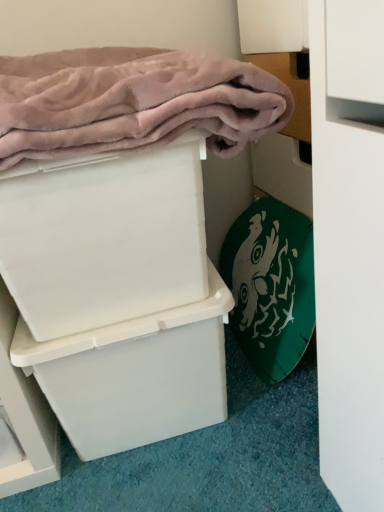
In order to face pink plush bath towel at upper left, which is the first bath towel in left-to-right order, should I rotate leftwards or rightwards?

A 11.622 degree turn to the left will do.

Describe the element at coordinates (104, 236) in the screenshot. This screenshot has height=512, width=384. I see `white plastic box at upper left, which is counted as the 2th box, starting from the bottom` at that location.

Locate an element on the screen. pink plush bath towel at upper left, the 2th bath towel from the right is located at coordinates (132, 101).

Is white plastic box at center, the first box in the bottom-to-top sequence, looking in the opposite direction of green fabric bath towel at lower right, which appears as the second bath towel when viewed from the left?

white plastic box at center, the first box in the bottom-to-top sequence, does not have its back to green fabric bath towel at lower right, which appears as the second bath towel when viewed from the left.

Considering the sizes of objects white plastic box at center, the first box in the bottom-to-top sequence, and green fabric bath towel at lower right, which is the first bath towel from bottom to top, in the image provided, who is taller, white plastic box at center, the first box in the bottom-to-top sequence, or green fabric bath towel at lower right, which is the first bath towel from bottom to top,?

With more height is green fabric bath towel at lower right, which is the first bath towel from bottom to top.

From the image's perspective, which bath towel is the 1st one above the white plastic box at center, the first box in the bottom-to-top sequence? Please provide its 2D coordinates.

[(271, 285)]

Can you confirm if white plastic box at center, the first box in the bottom-to-top sequence, is wider than green fabric bath towel at lower right, positioned as the second bath towel in top-to-bottom order?

Correct, the width of white plastic box at center, the first box in the bottom-to-top sequence, exceeds that of green fabric bath towel at lower right, positioned as the second bath towel in top-to-bottom order.

In terms of height, does pink plush bath towel at upper left, which appears as the 2th bath towel when ordered from the bottom, look taller or shorter compared to white plastic box at upper left, which is counted as the 2th box, starting from the bottom?

Considering their sizes, pink plush bath towel at upper left, which appears as the 2th bath towel when ordered from the bottom, has less height than white plastic box at upper left, which is counted as the 2th box, starting from the bottom.

Does pink plush bath towel at upper left, which is the first bath towel in left-to-right order, have a greater width compared to white plastic box at upper left, the first box in the top-to-bottom sequence?

Indeed, pink plush bath towel at upper left, which is the first bath towel in left-to-right order, has a greater width compared to white plastic box at upper left, the first box in the top-to-bottom sequence.

Considering the positions of objects pink plush bath towel at upper left, which is the first bath towel in left-to-right order, and white plastic box at upper left, the first box in the top-to-bottom sequence, in the image provided, who is more to the left, pink plush bath towel at upper left, which is the first bath towel in left-to-right order, or white plastic box at upper left, the first box in the top-to-bottom sequence,?

From the viewer's perspective, white plastic box at upper left, the first box in the top-to-bottom sequence, appears more on the left side.

Is white plastic box at upper left, which is counted as the 2th box, starting from the bottom, not close to white plastic box at center, the second box viewed from the top?

No, there isn't a large distance between white plastic box at upper left, which is counted as the 2th box, starting from the bottom, and white plastic box at center, the second box viewed from the top.

Considering their positions, is white plastic box at upper left, the first box in the top-to-bottom sequence, located in front of or behind white plastic box at center, the second box viewed from the top?

In the image, white plastic box at upper left, the first box in the top-to-bottom sequence, appears in front of white plastic box at center, the second box viewed from the top.

Is white plastic box at upper left, which is counted as the 2th box, starting from the bottom, shorter than white plastic box at center, the second box viewed from the top?

Yes, white plastic box at upper left, which is counted as the 2th box, starting from the bottom, is shorter than white plastic box at center, the second box viewed from the top.

Is white plastic box at upper left, the first box in the top-to-bottom sequence, oriented towards white plastic box at center, the second box viewed from the top?

No, white plastic box at upper left, the first box in the top-to-bottom sequence, is not oriented towards white plastic box at center, the second box viewed from the top.

Is there a large distance between green fabric bath towel at lower right, which is the first bath towel from bottom to top, and white plastic box at center, the first box in the bottom-to-top sequence?

green fabric bath towel at lower right, which is the first bath towel from bottom to top, is actually quite close to white plastic box at center, the first box in the bottom-to-top sequence.

Based on the photo, considering the positions of objects green fabric bath towel at lower right, which appears as the second bath towel when viewed from the left, and white plastic box at center, the first box in the bottom-to-top sequence, in the image provided, who is more to the right, green fabric bath towel at lower right, which appears as the second bath towel when viewed from the left, or white plastic box at center, the first box in the bottom-to-top sequence,?

Positioned to the right is green fabric bath towel at lower right, which appears as the second bath towel when viewed from the left.

From the image's perspective, which one is positioned lower, green fabric bath towel at lower right, which appears as the second bath towel when viewed from the left, or white plastic box at center, the first box in the bottom-to-top sequence?

white plastic box at center, the first box in the bottom-to-top sequence, appears lower in the image.

Which is nearer, (274,202) or (99,395)?

The point (99,395) is closer.

Is white plastic box at upper left, the first box in the top-to-bottom sequence, completely or partially outside of green fabric bath towel at lower right, which is the first bath towel from bottom to top?

Yes, white plastic box at upper left, the first box in the top-to-bottom sequence, is not within green fabric bath towel at lower right, which is the first bath towel from bottom to top.

Are white plastic box at upper left, which is counted as the 2th box, starting from the bottom, and green fabric bath towel at lower right, which is the first bath towel from bottom to top, far apart?

No, white plastic box at upper left, which is counted as the 2th box, starting from the bottom, is in close proximity to green fabric bath towel at lower right, which is the first bath towel from bottom to top.

Who is taller, white plastic box at upper left, which is counted as the 2th box, starting from the bottom, or green fabric bath towel at lower right, which is the first bath towel from bottom to top?

With more height is green fabric bath towel at lower right, which is the first bath towel from bottom to top.

Measure the distance from white plastic box at center, the second box viewed from the top, to pink plush bath towel at upper left, the 2th bath towel from the right.

They are 14.73 inches apart.

From the image's perspective, which is below, white plastic box at center, the first box in the bottom-to-top sequence, or pink plush bath towel at upper left, which is the first bath towel in left-to-right order?

white plastic box at center, the first box in the bottom-to-top sequence, from the image's perspective.

The height and width of the screenshot is (512, 384). What are the coordinates of `the 2nd box below the pink plush bath towel at upper left, the 2th bath towel from the right (from the image's perspective)` in the screenshot? It's located at (135, 375).

From a real-world perspective, is pink plush bath towel at upper left, which appears as the 2th bath towel when ordered from the bottom, located higher than green fabric bath towel at lower right, which is counted as the first bath towel, starting from the right?

Yes.

From the image's perspective, does pink plush bath towel at upper left, which is the first bath towel in left-to-right order, appear lower than green fabric bath towel at lower right, which is counted as the first bath towel, starting from the right?

No, from the image's perspective, pink plush bath towel at upper left, which is the first bath towel in left-to-right order, is not below green fabric bath towel at lower right, which is counted as the first bath towel, starting from the right.

Is pink plush bath towel at upper left, which appears as the 2th bath towel when ordered from the bottom, thinner than green fabric bath towel at lower right, which is counted as the first bath towel, starting from the right?

No.

You are a GUI agent. You are given a task and a screenshot of the screen. Output one action in this format:
    pyautogui.click(x=<x>, y=<y>)
    Task: Click on the box that is the 1st one when counting forward from the green fabric bath towel at lower right, positioned as the second bath towel in top-to-bottom order
    Image resolution: width=384 pixels, height=512 pixels.
    Given the screenshot: What is the action you would take?
    pyautogui.click(x=135, y=375)

In the image, there is a white plastic box at upper left, the first box in the top-to-bottom sequence. At what (x,y) coordinates should I click in order to perform the action: click on bath towel above it (from the image's perspective). Please return your answer as a coordinate pair (x, y). Looking at the image, I should click on (132, 101).

Consider the image. Looking at the image, which one is located closer to white plastic box at upper left, which is counted as the 2th box, starting from the bottom, white plastic box at center, the first box in the bottom-to-top sequence, or green fabric bath towel at lower right, which is the first bath towel from bottom to top?

The object closer to white plastic box at upper left, which is counted as the 2th box, starting from the bottom, is white plastic box at center, the first box in the bottom-to-top sequence.

Looking at this image, which object lies further to the anchor point green fabric bath towel at lower right, which is counted as the first bath towel, starting from the right, pink plush bath towel at upper left, which is the first bath towel in left-to-right order, or white plastic box at center, the first box in the bottom-to-top sequence?

pink plush bath towel at upper left, which is the first bath towel in left-to-right order, is further to green fabric bath towel at lower right, which is counted as the first bath towel, starting from the right.

Based on their spatial positions, is white plastic box at upper left, the first box in the top-to-bottom sequence, or white plastic box at center, the second box viewed from the top, closer to pink plush bath towel at upper left, which is the first bath towel in left-to-right order?

white plastic box at upper left, the first box in the top-to-bottom sequence, is positioned closer to the anchor pink plush bath towel at upper left, which is the first bath towel in left-to-right order.

Based on their spatial positions, is white plastic box at upper left, the first box in the top-to-bottom sequence, or white plastic box at center, the first box in the bottom-to-top sequence, closer to green fabric bath towel at lower right, which appears as the second bath towel when viewed from the left?

white plastic box at center, the first box in the bottom-to-top sequence.

Considering their positions, is white plastic box at center, the first box in the bottom-to-top sequence, positioned further to pink plush bath towel at upper left, which appears as the 2th bath towel when ordered from the bottom, than green fabric bath towel at lower right, which is counted as the first bath towel, starting from the right?

green fabric bath towel at lower right, which is counted as the first bath towel, starting from the right, is further to pink plush bath towel at upper left, which appears as the 2th bath towel when ordered from the bottom.

Looking at the image, which one is located closer to white plastic box at center, the second box viewed from the top, green fabric bath towel at lower right, which is counted as the first bath towel, starting from the right, or pink plush bath towel at upper left, which appears as the 2th bath towel when ordered from the bottom?

green fabric bath towel at lower right, which is counted as the first bath towel, starting from the right, is closer to white plastic box at center, the second box viewed from the top.

Considering their positions, is white plastic box at center, the first box in the bottom-to-top sequence, positioned closer to green fabric bath towel at lower right, which is counted as the first bath towel, starting from the right, than white plastic box at upper left, the first box in the top-to-bottom sequence?

white plastic box at center, the first box in the bottom-to-top sequence, lies closer to green fabric bath towel at lower right, which is counted as the first bath towel, starting from the right, than the other object.

Based on their spatial positions, is white plastic box at upper left, which is counted as the 2th box, starting from the bottom, or pink plush bath towel at upper left, the 2th bath towel from the right, closer to green fabric bath towel at lower right, which is counted as the first bath towel, starting from the right?

white plastic box at upper left, which is counted as the 2th box, starting from the bottom, lies closer to green fabric bath towel at lower right, which is counted as the first bath towel, starting from the right, than the other object.

This screenshot has height=512, width=384. Find the location of `bath towel that lies between pink plush bath towel at upper left, which is the first bath towel in left-to-right order, and white plastic box at center, the second box viewed from the top, from top to bottom`. bath towel that lies between pink plush bath towel at upper left, which is the first bath towel in left-to-right order, and white plastic box at center, the second box viewed from the top, from top to bottom is located at coordinates (271, 285).

Identify the location of box between pink plush bath towel at upper left, which ranks as the first bath towel in top-to-bottom order, and white plastic box at center, the second box viewed from the top, from top to bottom. This screenshot has width=384, height=512. (104, 236).

Identify the location of box between white plastic box at upper left, which is counted as the 2th box, starting from the bottom, and green fabric bath towel at lower right, positioned as the second bath towel in top-to-bottom order. (135, 375).

The image size is (384, 512). I want to click on bath towel between white plastic box at upper left, which is counted as the 2th box, starting from the bottom, and green fabric bath towel at lower right, positioned as the second bath towel in top-to-bottom order, from left to right, so pos(132,101).